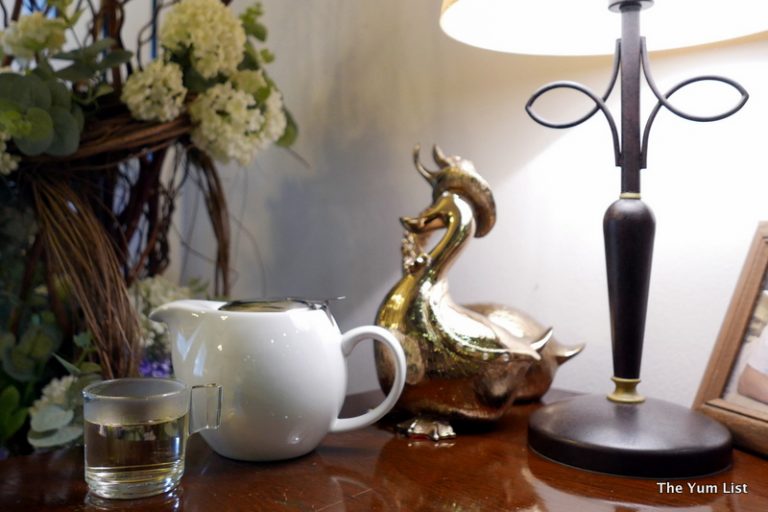
Identify the location of lamp. (618, 312).